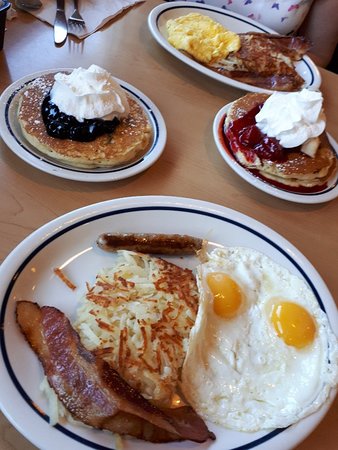
Locate an element on the screen. The image size is (338, 450). wood table is located at coordinates (177, 163).